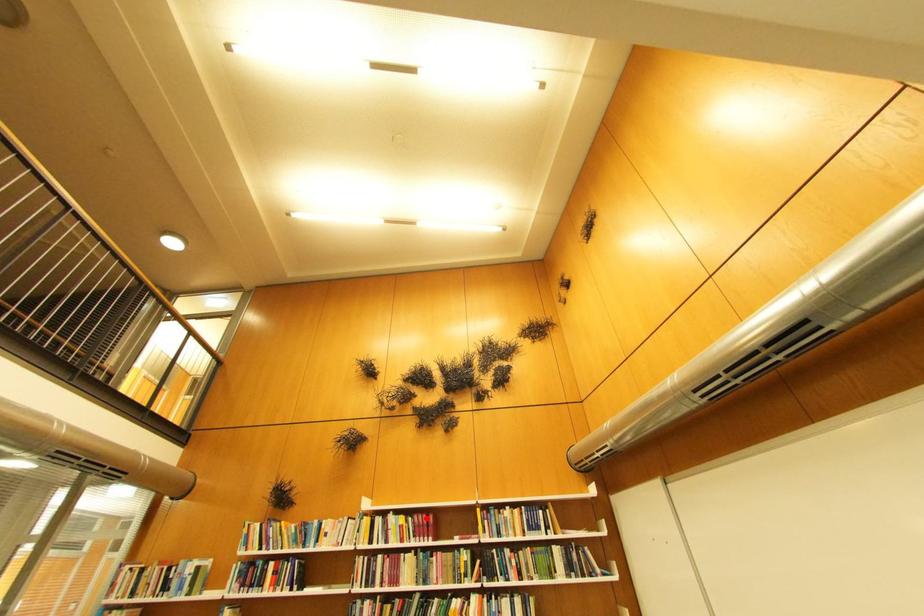
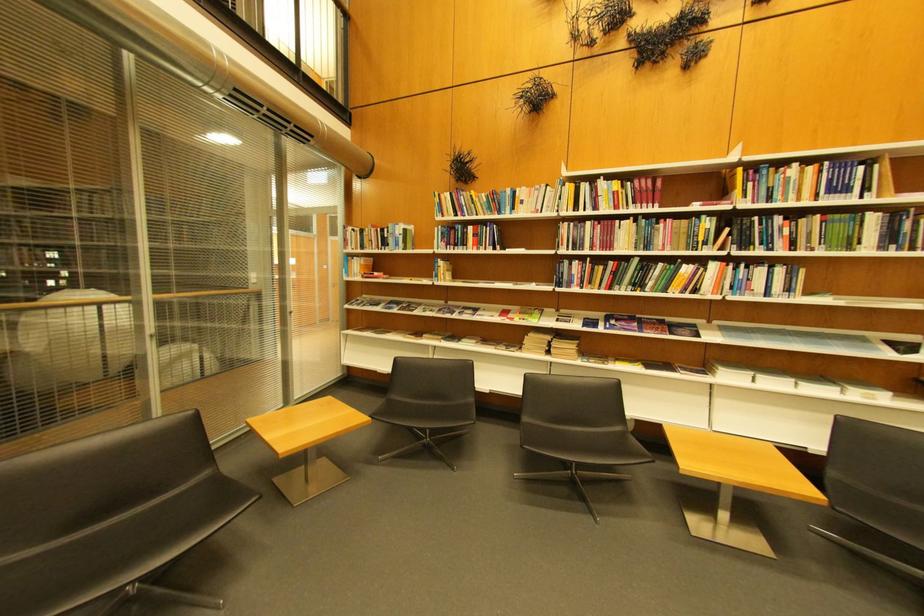
The point at the highlighted location is marked in the first image. Where is the corresponding point in the second image?

(648, 183)